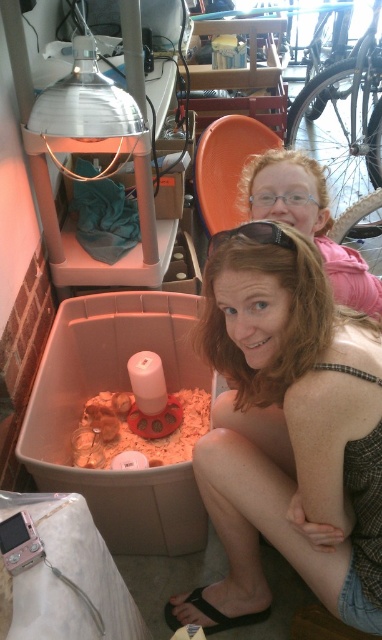
Question: Based on their relative distances, which object is nearer to the black plastic goggles at center?

Choices:
 (A) blonde hair at center
 (B) matte pink shirt at upper right

Answer: (A)

Question: From the image, what is the correct spatial relationship of blonde hair at center in relation to matte pink shirt at upper right?

Choices:
 (A) right
 (B) left

Answer: (B)

Question: Can you confirm if matte pink shirt at upper right is thinner than black plastic goggles at center?

Choices:
 (A) yes
 (B) no

Answer: (B)

Question: Which object is farther from the camera taking this photo?

Choices:
 (A) blonde hair at center
 (B) matte pink shirt at upper right
 (C) black plastic goggles at center

Answer: (B)

Question: Can you confirm if blonde hair at center is smaller than matte pink shirt at upper right?

Choices:
 (A) yes
 (B) no

Answer: (B)

Question: Which point is farther to the camera?

Choices:
 (A) (375, 442)
 (B) (265, 163)
 (C) (226, 230)

Answer: (B)